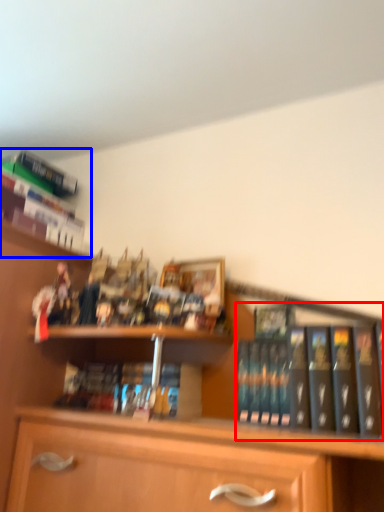
Question: Which point is further to the camera, book (highlighted by a red box) or book (highlighted by a blue box)?

Choices:
 (A) book
 (B) book

Answer: (B)